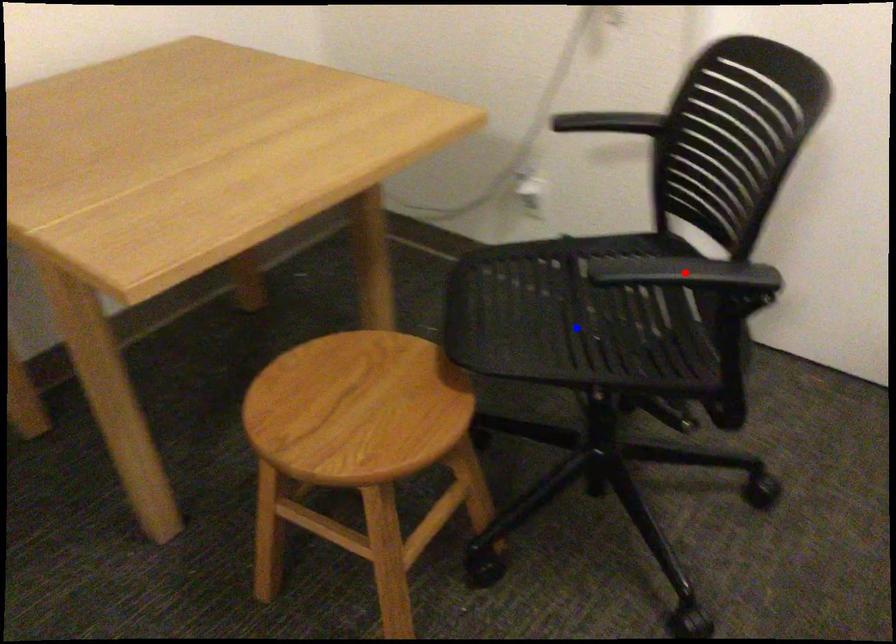
Question: Which of the two points in the image is closer to the camera?

Choices:
 (A) Blue point is closer.
 (B) Red point is closer.

Answer: (B)